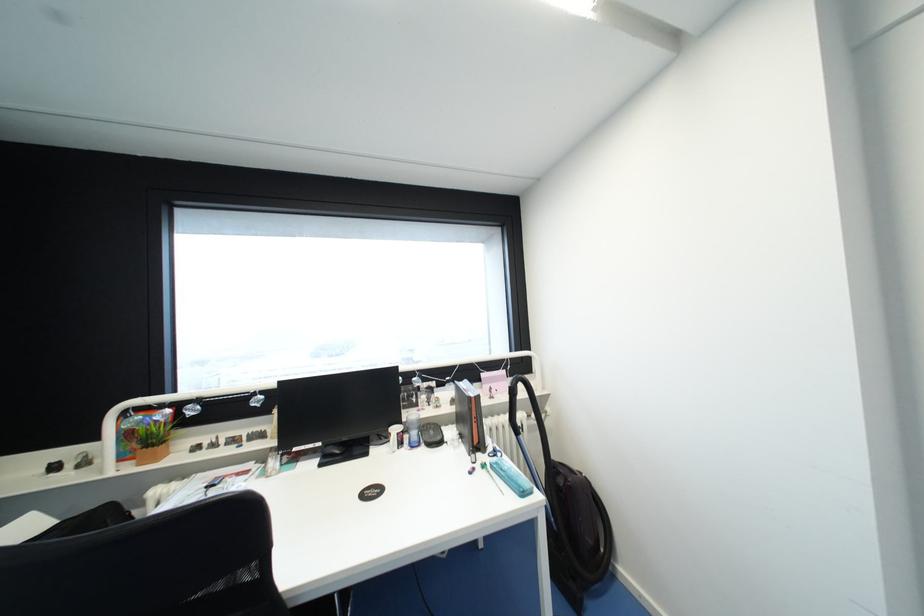
Where is `radiator valve`? The width and height of the screenshot is (924, 616). radiator valve is located at coordinates (515, 437).